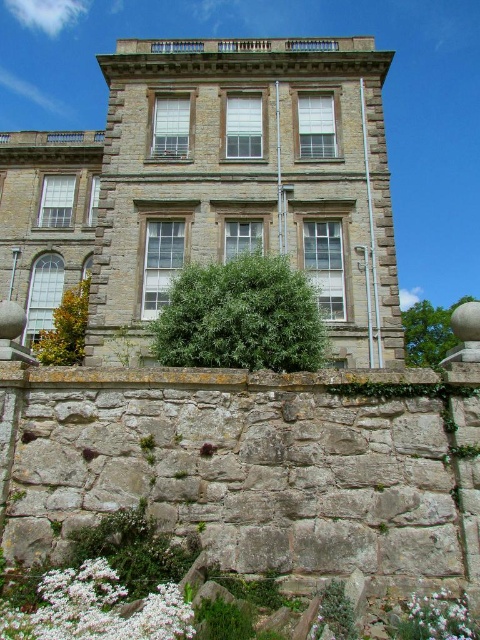
Question: Which point is farther to the camera?

Choices:
 (A) (428, 609)
 (B) (23, 634)

Answer: (A)

Question: Is white fluffy flower at lower left smaller than white matte flower at lower right?

Choices:
 (A) no
 (B) yes

Answer: (A)

Question: Can you confirm if white fluffy flower at lower left is thinner than white matte flower at lower right?

Choices:
 (A) yes
 (B) no

Answer: (B)

Question: Observing the image, what is the correct spatial positioning of white fluffy flower at lower left in reference to white matte flower at lower right?

Choices:
 (A) left
 (B) right

Answer: (A)

Question: Among these objects, which one is nearest to the camera?

Choices:
 (A) white matte flower at lower right
 (B) white fluffy flower at lower left

Answer: (B)